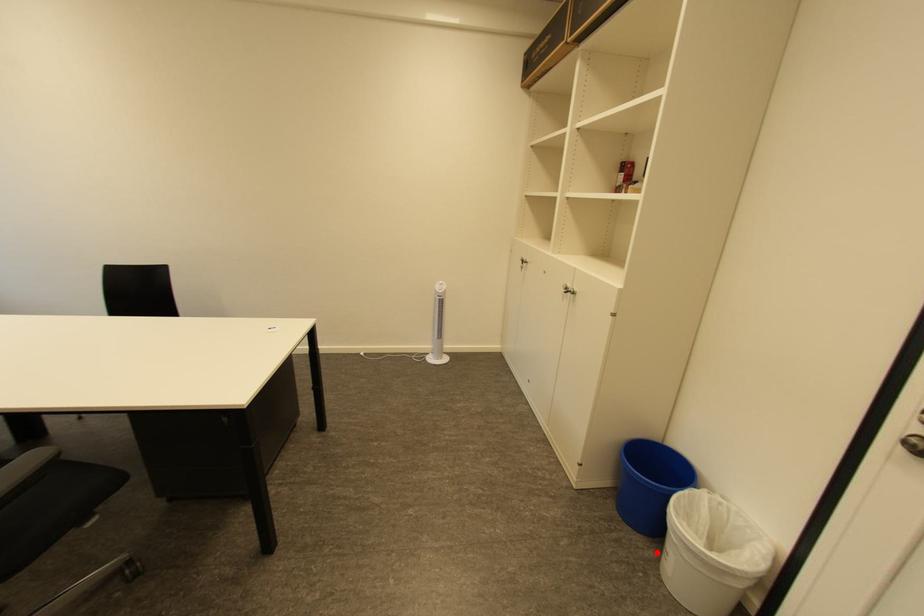
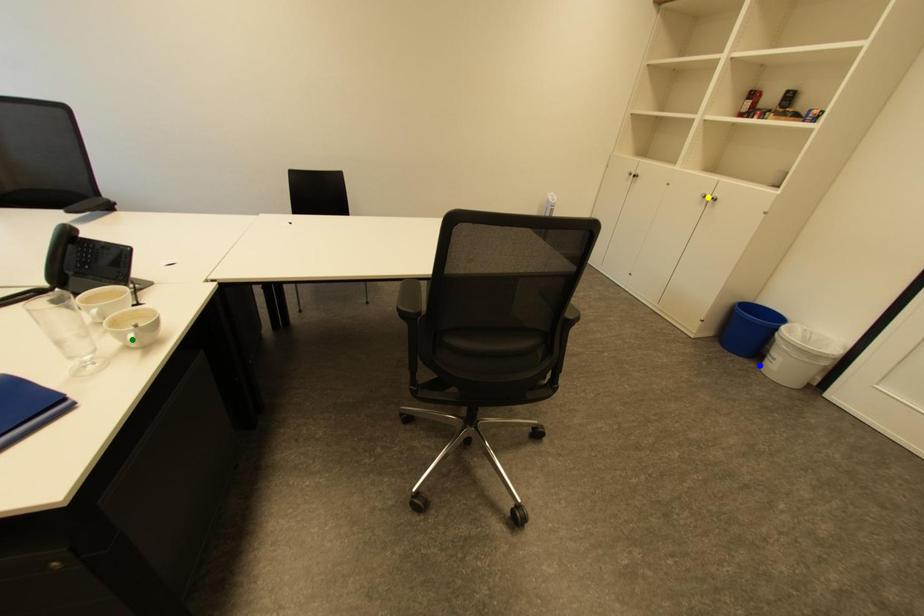
Question: I am providing you with two images of the same scene from different viewpoints. A red point is marked on the first image. You are given multiple points on the second image. Which spot in image 2 lines up with the point in image 1?

Choices:
 (A) green point
 (B) yellow point
 (C) blue point

Answer: (C)